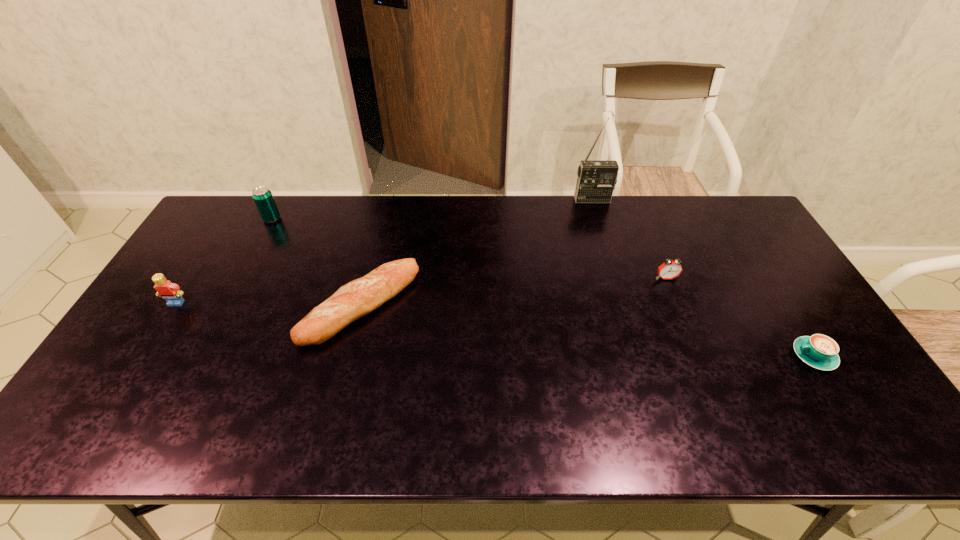
You are a GUI agent. You are given a task and a screenshot of the screen. Output one action in this format:
    pyautogui.click(x=<x>, y=<y>)
    Task: Click on the object located at the right edge
    The image size is (960, 540).
    Given the screenshot: What is the action you would take?
    819,351

Identify the location of free point at the far edge. The image size is (960, 540). (611, 236).

Image resolution: width=960 pixels, height=540 pixels. In the image, there is a desktop. Find the location of `free space at the near edge`. free space at the near edge is located at coordinates (485, 437).

I want to click on vacant area at the right edge, so click(x=781, y=287).

Locate an element on the screen. vacant space at the far right corner of the desktop is located at coordinates (717, 206).

This screenshot has height=540, width=960. Find the location of `vacant area that lies between the fourth object from left to right and the baguet`. vacant area that lies between the fourth object from left to right and the baguet is located at coordinates (477, 252).

The image size is (960, 540). What are the coordinates of `vacant space in between the shortest object and the third object from left to right` in the screenshot? It's located at (588, 330).

Locate an element on the screen. vacant space that is in between the Lego and the fifth object from left to right is located at coordinates (421, 291).

At what (x,y) coordinates should I click in order to perform the action: click on vacant area between the third object from left to right and the Lego. Please return your answer as a coordinate pair (x, y). The width and height of the screenshot is (960, 540). Looking at the image, I should click on (269, 303).

You are a GUI agent. You are given a task and a screenshot of the screen. Output one action in this format:
    pyautogui.click(x=<x>, y=<y>)
    Task: Click on the free space between the radio receiver and the leftmost object
    
    Given the screenshot: What is the action you would take?
    pyautogui.click(x=384, y=251)